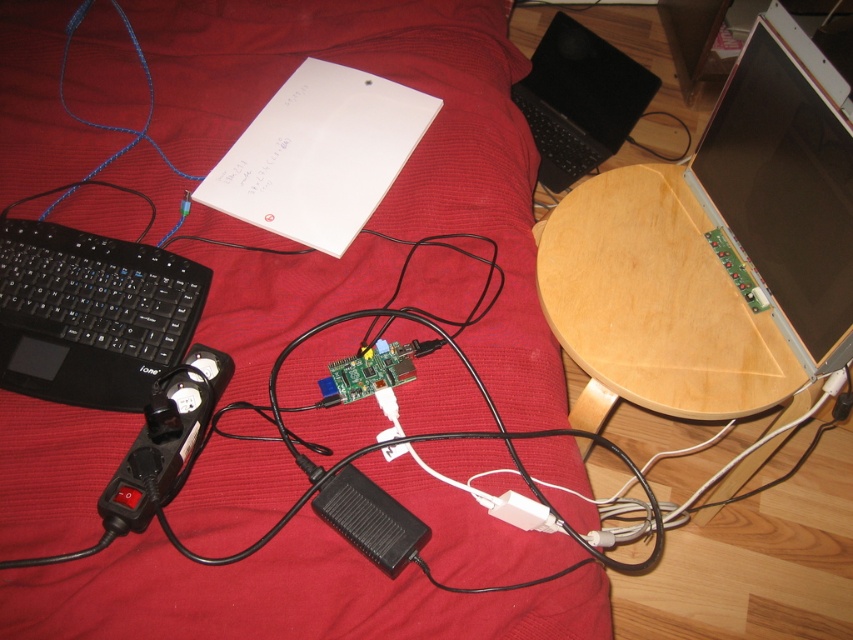
You are a delivery robot trying to place a package on the bed. The bed is represented by the point at coordinates (410, 154). Can you safely place the package on the bed without it falling off?

The point at coordinates (410, 154) corresponds to the red fabric bed at center, so yes, you can safely place the package on the bed at that point as it is the center of the bed where the bed is stable.